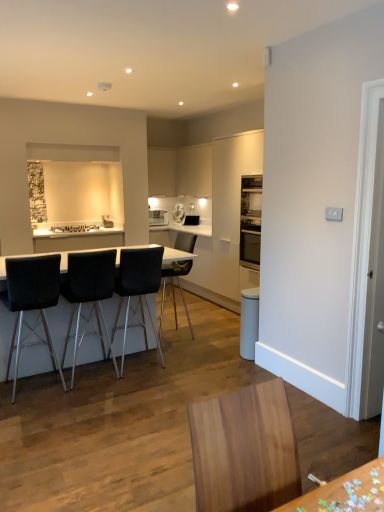
Locate an element on the screen. The width and height of the screenshot is (384, 512). free location to the right of black leather chair at center, placed as the 2th chair when sorted from right to left is located at coordinates (188, 360).